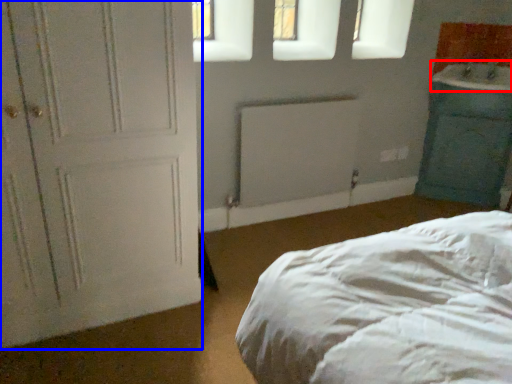
Question: Which object is closer to the camera taking this photo, sink (highlighted by a red box) or door (highlighted by a blue box)?

Choices:
 (A) sink
 (B) door

Answer: (B)